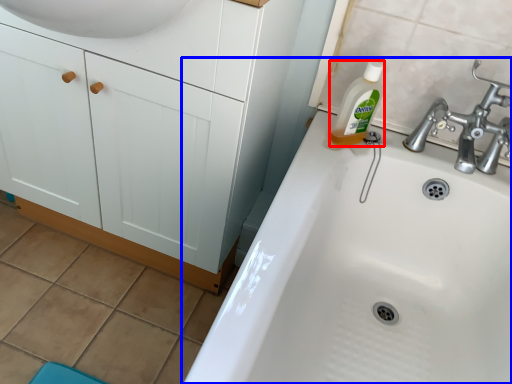
Question: Which of the following is the closest to the observer, cleaning product (highlighted by a red box) or sink (highlighted by a blue box)?

Choices:
 (A) cleaning product
 (B) sink

Answer: (B)